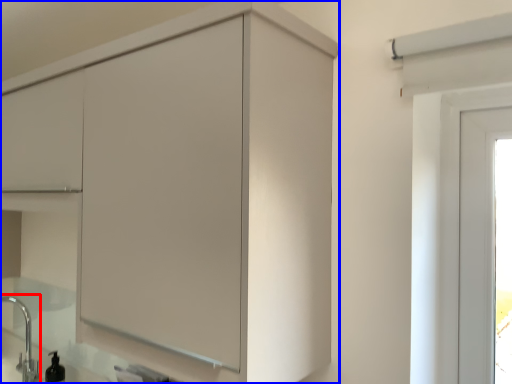
Question: Which of the following is the farthest to the observer, faucet (highlighted by a red box) or cupboard (highlighted by a blue box)?

Choices:
 (A) faucet
 (B) cupboard

Answer: (A)